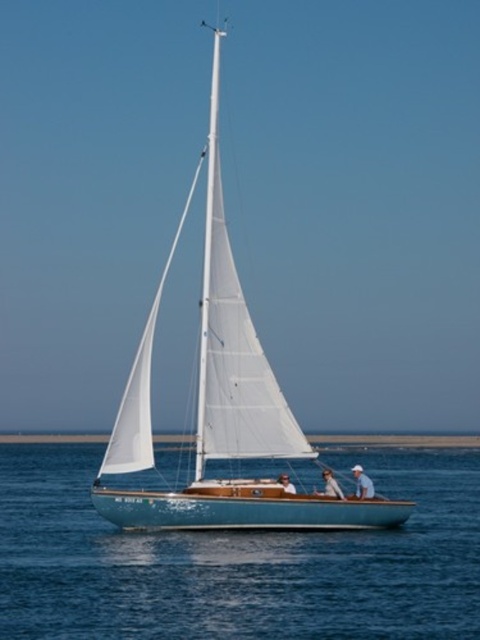
Does blue smooth water at center lie in front of light blue fabric sailboat at center?

Yes.

Does blue smooth water at center have a lesser width compared to light blue fabric sailboat at center?

No.

The image size is (480, 640). Identify the location of blue smooth water at center. (238, 561).

Locate an element on the screen. The image size is (480, 640). blue smooth water at center is located at coordinates (238, 561).

Which of these two, white fabric hat at lower center or light brown wooden sailboat at center, stands shorter?

Standing shorter between the two is light brown wooden sailboat at center.

Is point (373, 490) in front of point (291, 484)?

No, (373, 490) is behind (291, 484).

You are a GUI agent. You are given a task and a screenshot of the screen. Output one action in this format:
    pyautogui.click(x=<x>, y=<y>)
    Task: Click on the white fabric hat at lower center
    Image resolution: width=480 pixels, height=640 pixels.
    Given the screenshot: What is the action you would take?
    (362, 483)

Can you confirm if blue smooth water at center is shorter than teal polished wood sailboat at center?

Yes, blue smooth water at center is shorter than teal polished wood sailboat at center.

Is point (192, 588) positioned behind point (225, 396)?

That is False.

Between point (108, 481) and point (120, 456), which one is positioned behind?

The point (108, 481) is behind.

In order to click on blue smooth water at center in this screenshot , I will do `click(238, 561)`.